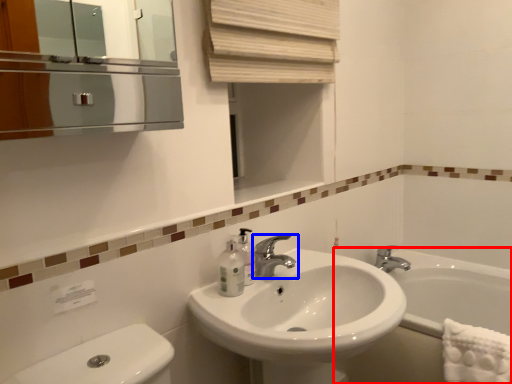
Question: Which point is closer to the camera, bath (highlighted by a red box) or tap (highlighted by a blue box)?

Choices:
 (A) bath
 (B) tap

Answer: (B)